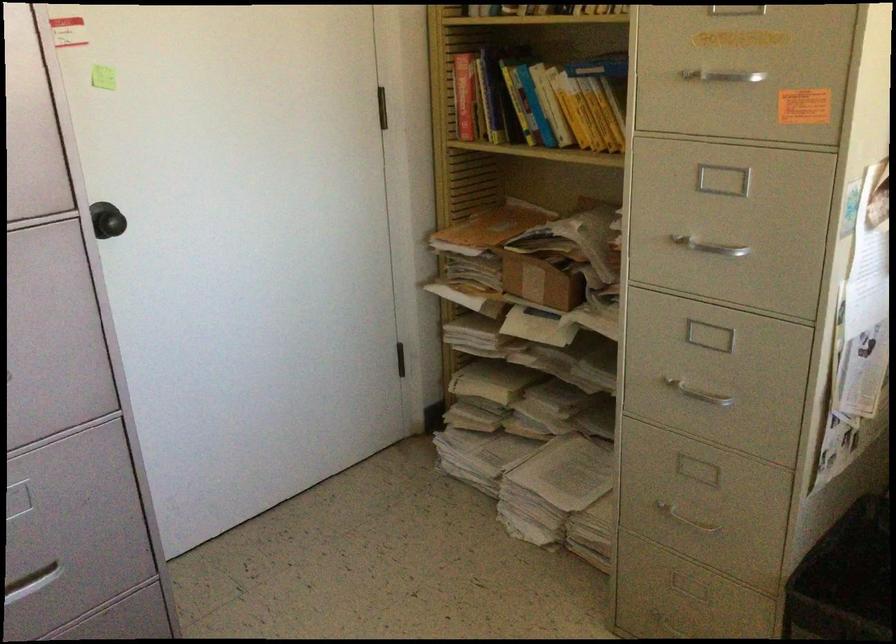
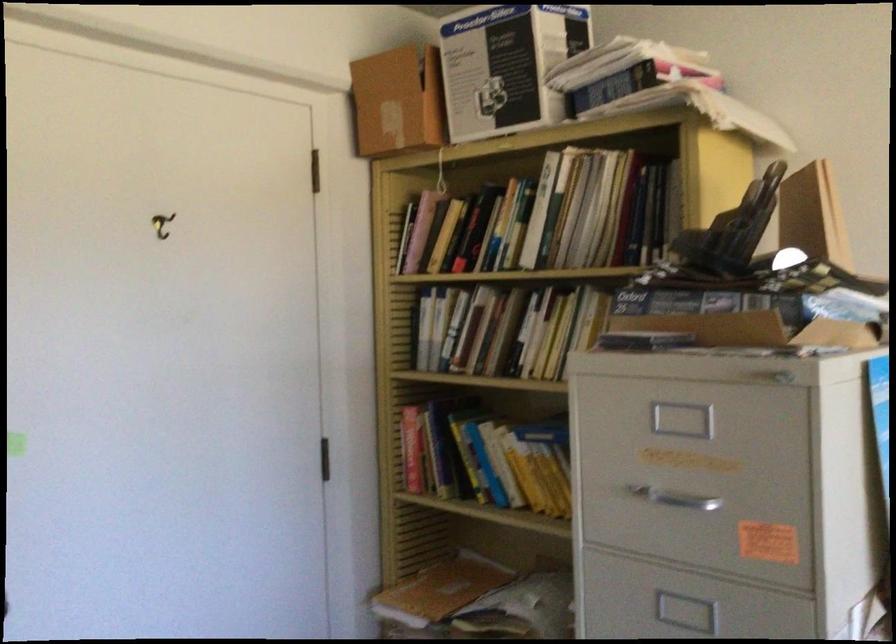
Question: How did the camera likely rotate?

Choices:
 (A) Left
 (B) Right
 (C) Up
 (D) Down

Answer: (C)